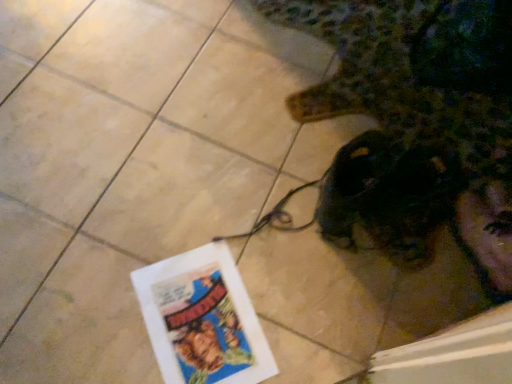
Question: Considering the relative sizes of white paper flyer at lower left and shiny black headphones at lower right in the image provided, is white paper flyer at lower left shorter than shiny black headphones at lower right?

Choices:
 (A) yes
 (B) no

Answer: (A)

Question: Is there a large distance between white paper flyer at lower left and shiny black headphones at lower right?

Choices:
 (A) no
 (B) yes

Answer: (A)

Question: Considering the relative positions of white paper flyer at lower left and shiny black headphones at lower right in the image provided, is white paper flyer at lower left to the right of shiny black headphones at lower right from the viewer's perspective?

Choices:
 (A) no
 (B) yes

Answer: (A)

Question: From a real-world perspective, is white paper flyer at lower left positioned over shiny black headphones at lower right based on gravity?

Choices:
 (A) yes
 (B) no

Answer: (B)

Question: Is white paper flyer at lower left facing towards shiny black headphones at lower right?

Choices:
 (A) no
 (B) yes

Answer: (A)

Question: Can we say white paper flyer at lower left lies outside shiny black headphones at lower right?

Choices:
 (A) no
 (B) yes

Answer: (B)

Question: Can you confirm if shiny black headphones at lower right is thinner than white paper flyer at lower left?

Choices:
 (A) yes
 (B) no

Answer: (B)

Question: Is shiny black headphones at lower right positioned beyond the bounds of white paper flyer at lower left?

Choices:
 (A) yes
 (B) no

Answer: (A)

Question: From a real-world perspective, is shiny black headphones at lower right below white paper flyer at lower left?

Choices:
 (A) yes
 (B) no

Answer: (B)

Question: Can you confirm if shiny black headphones at lower right is shorter than white paper flyer at lower left?

Choices:
 (A) no
 (B) yes

Answer: (A)

Question: Considering the relative sizes of shiny black headphones at lower right and white paper flyer at lower left in the image provided, is shiny black headphones at lower right bigger than white paper flyer at lower left?

Choices:
 (A) no
 (B) yes

Answer: (B)

Question: Is shiny black headphones at lower right in front of white paper flyer at lower left?

Choices:
 (A) no
 (B) yes

Answer: (B)

Question: In the image, is shiny black headphones at lower right on the left side or the right side of white paper flyer at lower left?

Choices:
 (A) right
 (B) left

Answer: (A)